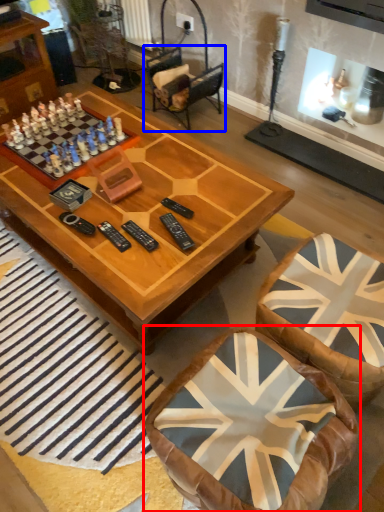
Question: Which point is further to the camera, chair (highlighted by a red box) or armchair (highlighted by a blue box)?

Choices:
 (A) chair
 (B) armchair

Answer: (B)